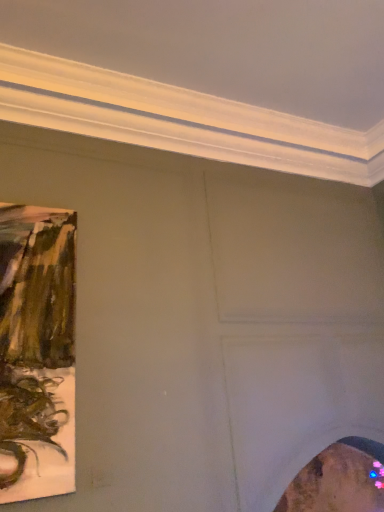
Question: From a real-world perspective, is matte brown painting at left, the 1th picture frame positioned from the left, physically located above or below wooden frame at lower right, which ranks as the first picture frame in bottom-to-top order?

Choices:
 (A) below
 (B) above

Answer: (B)

Question: Visually, is matte brown painting at left, which is the first picture frame in front-to-back order, positioned to the left or to the right of wooden frame at lower right, positioned as the second picture frame in top-to-bottom order?

Choices:
 (A) right
 (B) left

Answer: (B)

Question: From the image's perspective, is matte brown painting at left, positioned as the first picture frame in top-to-bottom order, positioned above or below wooden frame at lower right, which is the 2th picture frame in front-to-back order?

Choices:
 (A) below
 (B) above

Answer: (B)

Question: From the image's perspective, is wooden frame at lower right, which ranks as the first picture frame in right-to-left order, located above or below matte brown painting at left, which is the 2th picture frame from bottom to top?

Choices:
 (A) below
 (B) above

Answer: (A)

Question: Is wooden frame at lower right, which ranks as the first picture frame in bottom-to-top order, to the left or to the right of matte brown painting at left, which is the 2th picture frame in back-to-front order, in the image?

Choices:
 (A) right
 (B) left

Answer: (A)

Question: Considering the positions of wooden frame at lower right, the 2th picture frame viewed from the left, and matte brown painting at left, which is the 2th picture frame from bottom to top, in the image, is wooden frame at lower right, the 2th picture frame viewed from the left, bigger or smaller than matte brown painting at left, which is the 2th picture frame from bottom to top,?

Choices:
 (A) small
 (B) big

Answer: (B)

Question: Is wooden frame at lower right, the 2th picture frame viewed from the left, in front of or behind matte brown painting at left, which is the first picture frame in front-to-back order, in the image?

Choices:
 (A) front
 (B) behind

Answer: (B)